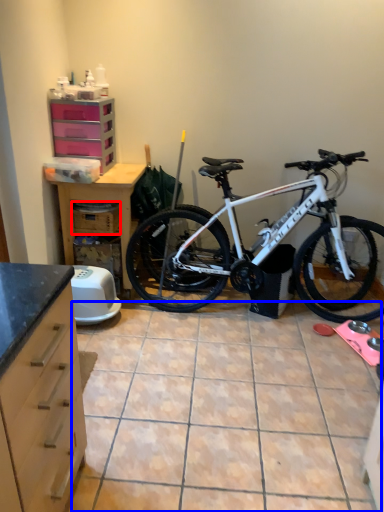
Question: Which object appears farthest to the camera in this image, crate (highlighted by a red box) or tile (highlighted by a blue box)?

Choices:
 (A) crate
 (B) tile

Answer: (A)